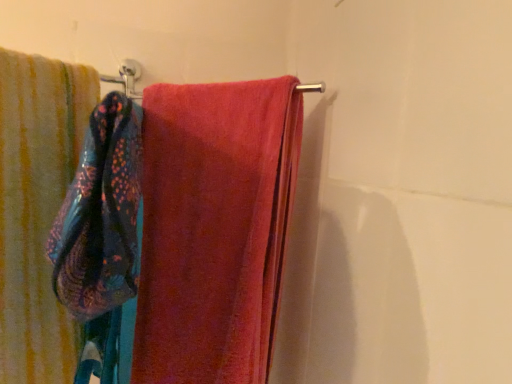
Question: Is soft cotton towel at left, which is the first towel from left to right, oriented towards blue textured towel at left?

Choices:
 (A) yes
 (B) no

Answer: (A)

Question: From the image's perspective, is soft cotton towel at left, which is the first towel from left to right, under blue textured towel at left?

Choices:
 (A) no
 (B) yes

Answer: (B)

Question: Is soft cotton towel at left, the 2th towel from the right, positioned beyond the bounds of blue textured towel at left?

Choices:
 (A) yes
 (B) no

Answer: (A)

Question: Considering the relative sizes of soft cotton towel at left, the 2th towel from the right, and blue textured towel at left in the image provided, is soft cotton towel at left, the 2th towel from the right, taller than blue textured towel at left?

Choices:
 (A) no
 (B) yes

Answer: (B)

Question: Considering the relative sizes of soft cotton towel at left, which is the first towel from left to right, and blue textured towel at left in the image provided, is soft cotton towel at left, which is the first towel from left to right, thinner than blue textured towel at left?

Choices:
 (A) no
 (B) yes

Answer: (A)

Question: From a real-world perspective, does soft cotton towel at left, the 2th towel from the right, sit lower than blue textured towel at left?

Choices:
 (A) no
 (B) yes

Answer: (B)

Question: Is blue textured towel at left positioned behind soft pink towel at center, which appears as the 1th towel when viewed from the right?

Choices:
 (A) no
 (B) yes

Answer: (A)

Question: Is soft pink towel at center, which appears as the 1th towel when viewed from the right, inside blue textured towel at left?

Choices:
 (A) yes
 (B) no

Answer: (B)

Question: Is blue textured towel at left to the left of soft pink towel at center, which appears as the 1th towel when viewed from the right, from the viewer's perspective?

Choices:
 (A) yes
 (B) no

Answer: (A)

Question: From the image's perspective, does blue textured towel at left appear lower than soft pink towel at center, which appears as the 1th towel when viewed from the right?

Choices:
 (A) no
 (B) yes

Answer: (A)

Question: Is blue textured towel at left positioned beyond the bounds of soft pink towel at center, which is counted as the 2th towel, starting from the left?

Choices:
 (A) no
 (B) yes

Answer: (B)

Question: Is blue textured towel at left facing away from soft pink towel at center, which is counted as the 2th towel, starting from the left?

Choices:
 (A) yes
 (B) no

Answer: (B)

Question: Is blue textured towel at left next to soft cotton towel at left, the 2th towel from the right, and touching it?

Choices:
 (A) no
 (B) yes

Answer: (A)